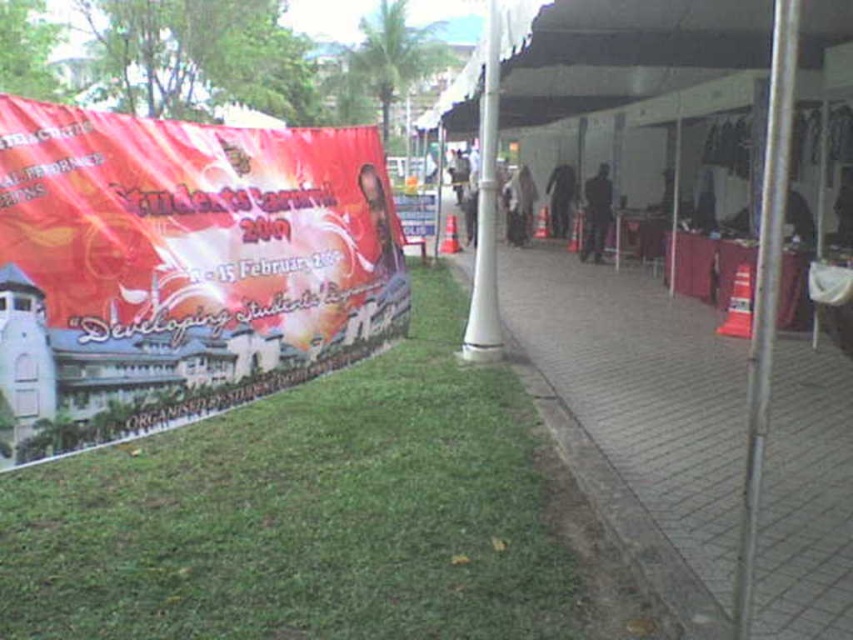
You are standing in front of the Students Carnival 2019 banner. Where is the brick paved sidewalk at center located in relation to the banner?

The brick paved sidewalk at center is located to the right of the banner, as it is positioned at point (642,410) in the image.

You are standing at the entrance of the Students Carnival 2019 event and see the large red banner on the left and the white fabric canopy at upper center. Based on their positions, which object is closer to the top edge of the image?

The white fabric canopy at upper center is closer to the top edge of the image because its position is at point (619, 51), which is closer to the top compared to the large red banner on the left.